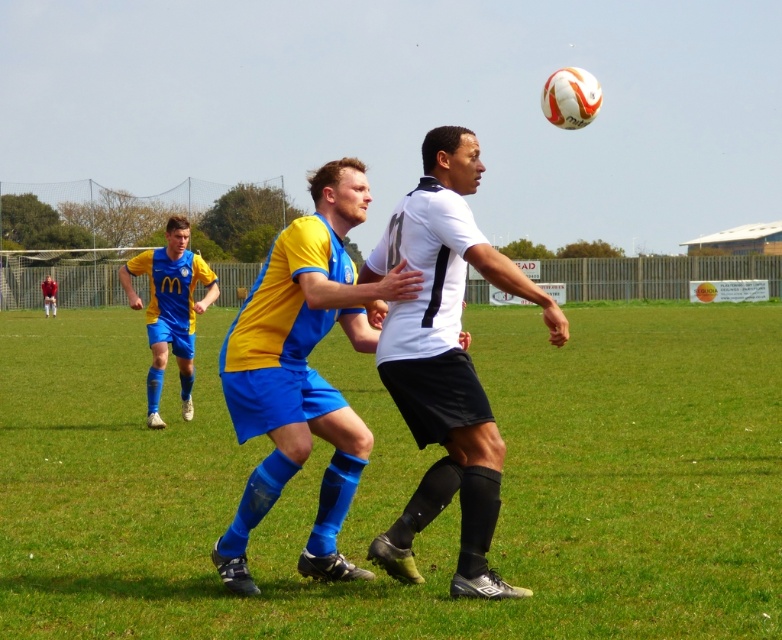
You are a soccer referee observing the match. You notice two players at the center of the field wearing a yellow jersey at center and a red fabric shirt at center. Which player is positioned to the right side of the other?

The yellow jersey at center is positioned on the right side of the red fabric shirt at center.

Where is the yellow jersey at center located in the image?

The yellow jersey at center is located at point coordinates of 0.484 on the x axis and 0.219 on the y axis.